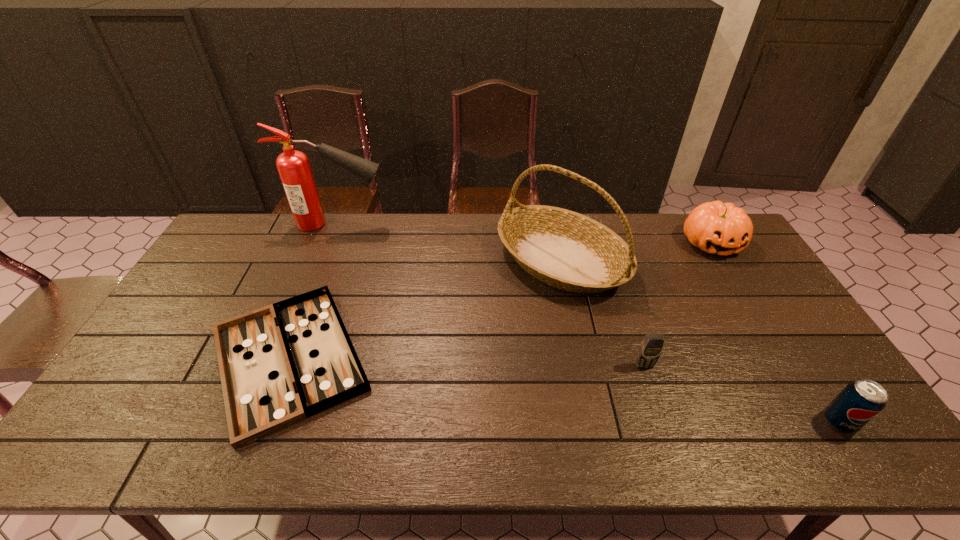
At what (x,y) coordinates should I click in order to perform the action: click on vacant space in between the soda can and the pumpkin. Please return your answer as a coordinate pair (x, y). Image resolution: width=960 pixels, height=540 pixels. Looking at the image, I should click on (776, 332).

Locate an element on the screen. The height and width of the screenshot is (540, 960). free spot between the fire extinguisher and the cellular telephone is located at coordinates (491, 295).

Find the location of a particular element. Image resolution: width=960 pixels, height=540 pixels. vacant space in between the shortest object and the pumpkin is located at coordinates (500, 300).

This screenshot has width=960, height=540. I want to click on empty space that is in between the shortest object and the cellular telephone, so click(467, 362).

Find the location of a particular element. This screenshot has height=540, width=960. vacant area between the pumpkin and the second tallest object is located at coordinates (636, 252).

Find the location of a particular element. Image resolution: width=960 pixels, height=540 pixels. empty space between the cellular telephone and the pumpkin is located at coordinates (678, 304).

Identify which object is the fourth nearest to the basket. Please provide its 2D coordinates. Your answer should be formatted as a tuple, i.e. [(x, y)], where the tuple contains the x and y coordinates of a point satisfying the conditions above.

[(293, 166)]

Find the location of a particular element. The width and height of the screenshot is (960, 540). the third closest object to the soda can is located at coordinates (719, 228).

Locate an element on the screen. The width and height of the screenshot is (960, 540). free space that satisfies the following two spatial constraints: 1. at the nozzle of the second tallest object; 2. on the right side of the fire extinguisher is located at coordinates (324, 260).

Where is `free spot that satisfies the following two spatial constraints: 1. on the back side of the soda can; 2. at the nozzle of the fire extinguisher`? The height and width of the screenshot is (540, 960). free spot that satisfies the following two spatial constraints: 1. on the back side of the soda can; 2. at the nozzle of the fire extinguisher is located at coordinates (711, 224).